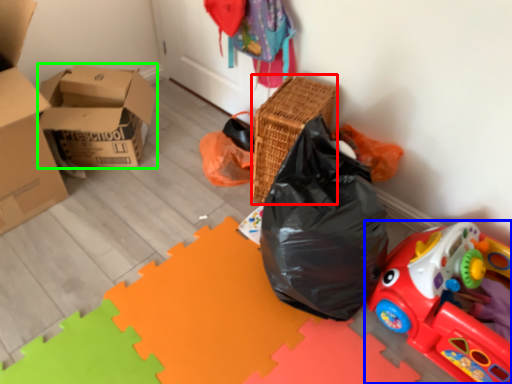
Question: Based on their relative distances, which object is nearer to basket (highlighted by a red box)? Choose from toy (highlighted by a blue box) and box (highlighted by a green box).

Choices:
 (A) toy
 (B) box

Answer: (A)